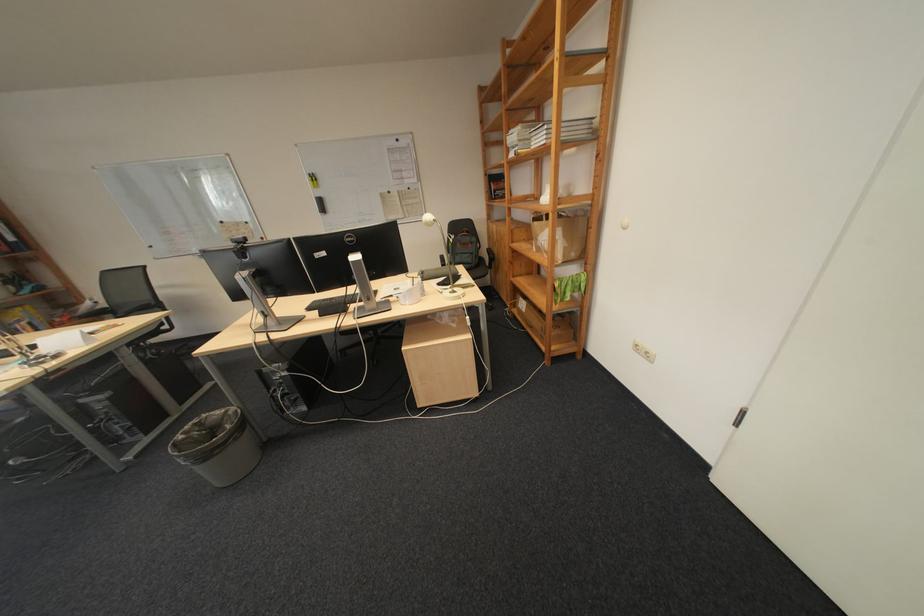
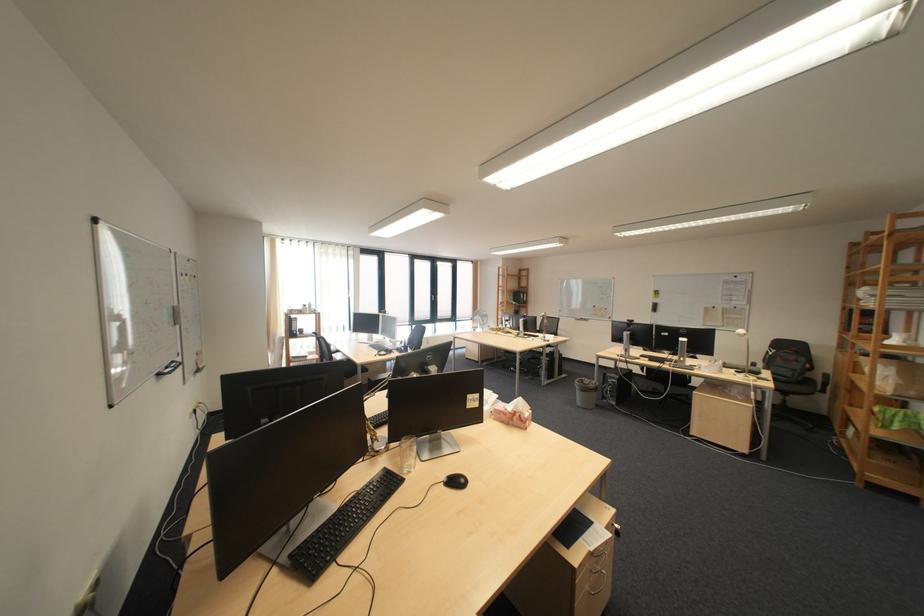
The point at (x=484, y=246) is marked in the first image. Where is the corresponding point in the second image?

(808, 365)